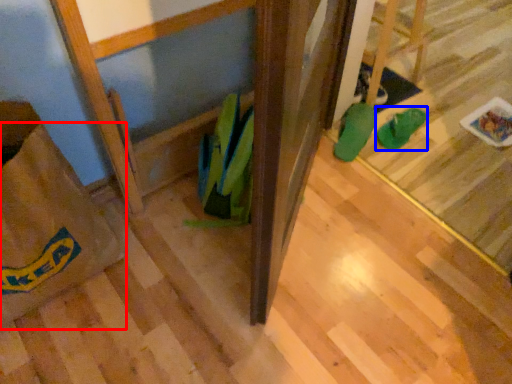
Question: Which point is further to the camera, grocery bag (highlighted by a red box) or footwear (highlighted by a blue box)?

Choices:
 (A) grocery bag
 (B) footwear

Answer: (B)